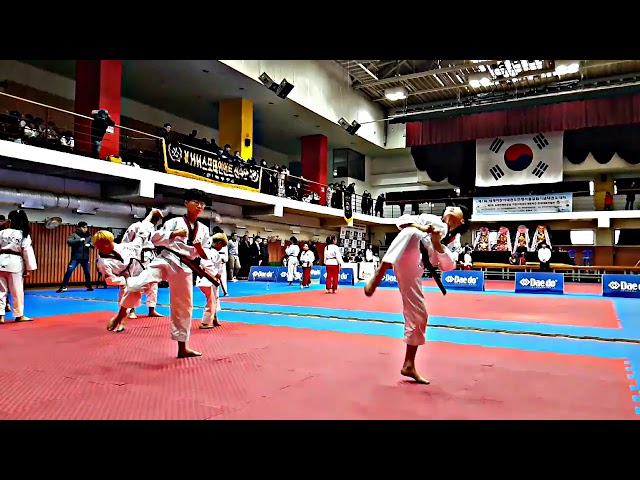
Where is `blue border of mats`? The image size is (640, 480). blue border of mats is located at coordinates (497, 343), (591, 333), (632, 309), (506, 288), (265, 287), (66, 308).